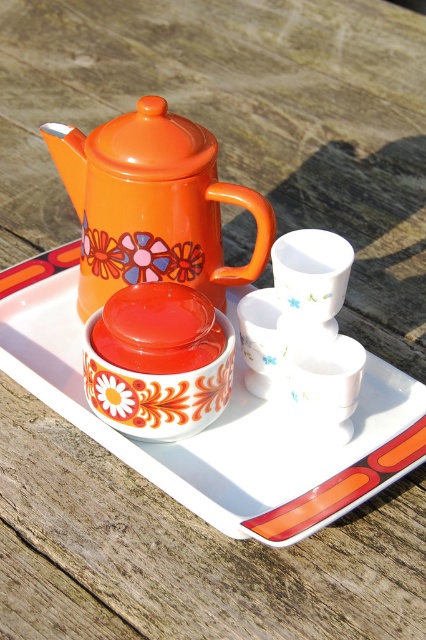
Question: Does orange glossy saucer at center have a smaller size compared to orange glossy teapot at upper left?

Choices:
 (A) no
 (B) yes

Answer: (A)

Question: Which of the following is the closest to the observer?

Choices:
 (A) (230, 516)
 (B) (97, 257)

Answer: (A)

Question: Can you confirm if orange glossy saucer at center is positioned to the right of orange glossy teapot at upper left?

Choices:
 (A) no
 (B) yes

Answer: (B)

Question: Can you confirm if orange glossy saucer at center is wider than orange glossy teapot at upper left?

Choices:
 (A) yes
 (B) no

Answer: (A)

Question: Which object appears farthest from the camera in this image?

Choices:
 (A) orange glossy teapot at upper left
 (B) orange glossy saucer at center

Answer: (A)